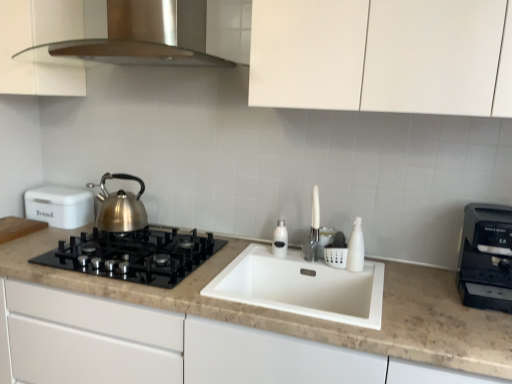
Where is `vacant space in front of brushed metal kettle at left`? This screenshot has width=512, height=384. vacant space in front of brushed metal kettle at left is located at coordinates (116, 238).